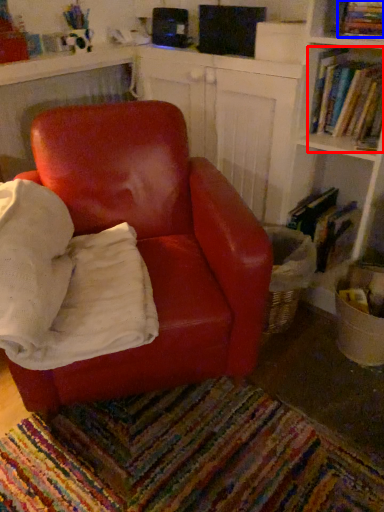
Question: Which point is further to the camera, book (highlighted by a red box) or book (highlighted by a blue box)?

Choices:
 (A) book
 (B) book

Answer: (A)